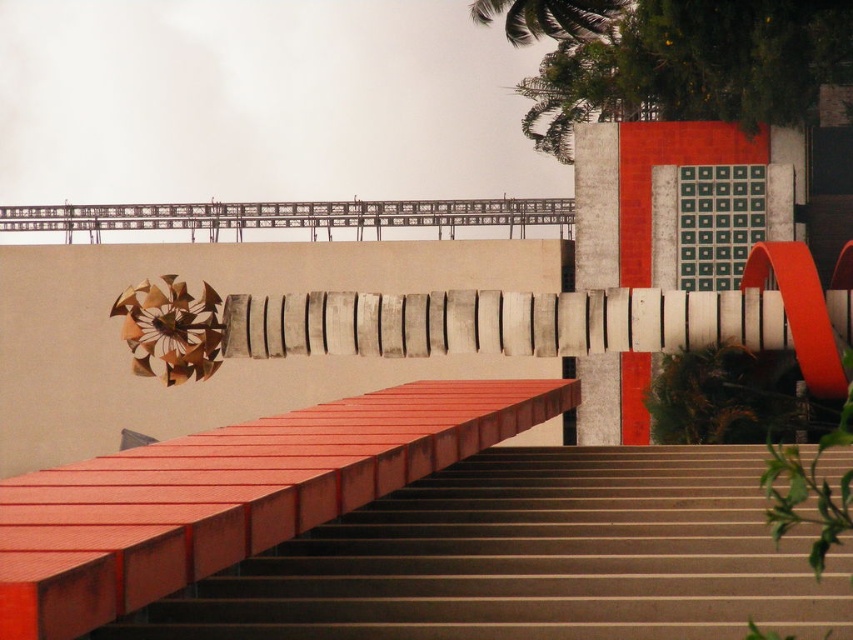
Question: Is brown concrete stairs at center further to camera compared to metallic silver balustrade at upper center?

Choices:
 (A) no
 (B) yes

Answer: (A)

Question: Which is farther from the metallic silver balustrade at upper center?

Choices:
 (A) green leafy palm tree at upper center
 (B) brown concrete stairs at center

Answer: (B)

Question: Can you confirm if brown concrete stairs at center is smaller than metallic silver balustrade at upper center?

Choices:
 (A) yes
 (B) no

Answer: (B)

Question: Does brown concrete stairs at center appear on the left side of metallic silver balustrade at upper center?

Choices:
 (A) no
 (B) yes

Answer: (A)

Question: Which of these objects is positioned farthest from the green leafy palm tree at upper center?

Choices:
 (A) metallic silver balustrade at upper center
 (B) brown concrete stairs at center

Answer: (B)

Question: Among these points, which one is nearest to the camera?

Choices:
 (A) (212, 241)
 (B) (607, 26)
 (C) (506, 634)

Answer: (C)